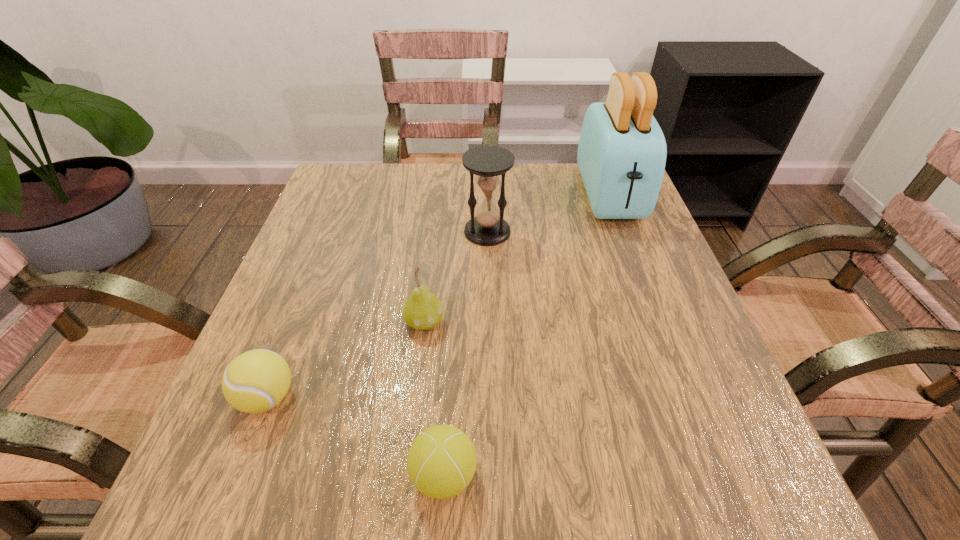
Find the location of a particular element. Image resolution: width=960 pixels, height=540 pixels. vacant space located 0.360m on the left of the hourglass is located at coordinates (306, 232).

Where is `free space located 0.290m on the front of the third shortest object`? This screenshot has width=960, height=540. free space located 0.290m on the front of the third shortest object is located at coordinates point(402,512).

You are a GUI agent. You are given a task and a screenshot of the screen. Output one action in this format:
    pyautogui.click(x=<x>, y=<y>)
    Task: Click on the vacant space situated on the back of the second nearest object
    The image size is (960, 540).
    Given the screenshot: What is the action you would take?
    pyautogui.click(x=306, y=298)

This screenshot has width=960, height=540. What are the coordinates of `vacant space located 0.230m on the back of the right tennis ball` in the screenshot? It's located at (453, 323).

This screenshot has height=540, width=960. What are the coordinates of `object that is at the far edge` in the screenshot? It's located at (622, 151).

The width and height of the screenshot is (960, 540). Find the location of `object located in the near edge section of the desktop`. object located in the near edge section of the desktop is located at coordinates (441, 462).

This screenshot has height=540, width=960. What are the coordinates of `object at the left edge` in the screenshot? It's located at (255, 381).

Where is `object positioned at the right edge`? Image resolution: width=960 pixels, height=540 pixels. object positioned at the right edge is located at coordinates (622, 151).

The height and width of the screenshot is (540, 960). In order to click on object that is at the far right corner in this screenshot , I will do `click(622, 151)`.

Locate an element on the screen. vacant region at the far edge is located at coordinates (434, 183).